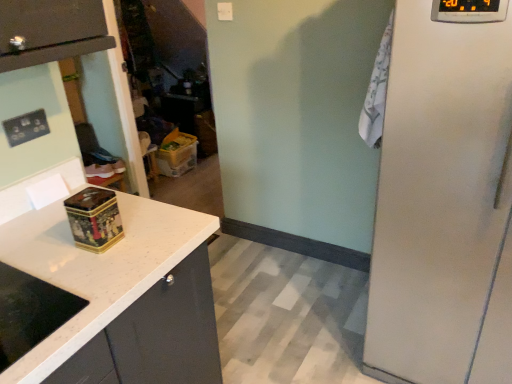
The width and height of the screenshot is (512, 384). Describe the element at coordinates (174, 90) in the screenshot. I see `transparent plastic door at center` at that location.

The height and width of the screenshot is (384, 512). What are the coordinates of `white granite countertop at left` in the screenshot? It's located at (156, 335).

This screenshot has height=384, width=512. Describe the element at coordinates (94, 219) in the screenshot. I see `gold metallic tin at center, the second appliance when ordered from front to back` at that location.

Identify the location of matte black outlet at upper left. The image size is (512, 384). (26, 127).

Which of these two, matte black outlet at upper left or transparent plastic door at center, is thinner?

With smaller width is matte black outlet at upper left.

Between matte black outlet at upper left and transparent plastic door at center, which one has smaller size?

Smaller between the two is matte black outlet at upper left.

Would you consider matte black outlet at upper left to be distant from transparent plastic door at center?

That's right, there is a large distance between matte black outlet at upper left and transparent plastic door at center.

In the scene shown: Considering the relative positions of matte black outlet at upper left and transparent plastic door at center in the image provided, is matte black outlet at upper left to the right of transparent plastic door at center from the viewer's perspective?

In fact, matte black outlet at upper left is to the left of transparent plastic door at center.

How many degrees apart are the facing directions of transparent plastic door at center and matte black outlet at upper left?

They differ by 88.8 degrees in their facing directions.

Is there a large distance between transparent plastic door at center and matte black outlet at upper left?

Yes, transparent plastic door at center and matte black outlet at upper left are located far from each other.

From a real-world perspective, is transparent plastic door at center beneath matte black outlet at upper left?

Yes, from a real-world perspective, transparent plastic door at center is below matte black outlet at upper left.

From the picture: Which is behind, transparent plastic door at center or matte black outlet at upper left?

transparent plastic door at center is more distant.

Does satin white refrigerator at right, the 1th appliance viewed from the top, turn towards transparent plastic door at center?

No, satin white refrigerator at right, the 1th appliance viewed from the top, is not turned towards transparent plastic door at center.

Which of these two, satin white refrigerator at right, marked as the second appliance in a bottom-to-top arrangement, or transparent plastic door at center, is smaller?

With smaller size is transparent plastic door at center.

From a real-world perspective, is satin white refrigerator at right, the first appliance from the front, below transparent plastic door at center?

Yes.

Is satin white refrigerator at right, the 1th appliance viewed from the top, positioned beyond the bounds of transparent plastic door at center?

Yes, satin white refrigerator at right, the 1th appliance viewed from the top, is not within transparent plastic door at center.

Which is in front, point (430, 364) or point (15, 130)?

The point (15, 130) is closer to the camera.

Where is `electric outlet above the satin white refrigerator at right, which appears as the second appliance when viewed from the back (from a real-world perspective)`? The image size is (512, 384). electric outlet above the satin white refrigerator at right, which appears as the second appliance when viewed from the back (from a real-world perspective) is located at coordinates (26, 127).

From a real-world perspective, does satin white refrigerator at right, the first appliance from the front, sit lower than matte black outlet at upper left?

Yes.

Can you tell me how much satin white refrigerator at right, the 1th appliance viewed from the top, and matte black outlet at upper left differ in facing direction?

90.3 degrees.

Between transparent plastic door at center and gold metallic tin at center, the 2th appliance viewed from the right, which one is positioned behind?

transparent plastic door at center is further from the camera.

Could you measure the distance between transparent plastic door at center and gold metallic tin at center, the 2th appliance viewed from the right?

They are 2.39 meters apart.

Is transparent plastic door at center facing away from gold metallic tin at center, which ranks as the first appliance in left-to-right order?

No, transparent plastic door at center is not facing away from gold metallic tin at center, which ranks as the first appliance in left-to-right order.

Is transparent plastic door at center positioned beyond the bounds of gold metallic tin at center, acting as the 1th appliance starting from the bottom?

Yes, transparent plastic door at center is not within gold metallic tin at center, acting as the 1th appliance starting from the bottom.

Which point is more forward, (92, 230) or (188, 110)?

The point (92, 230) is in front.

Between gold metallic tin at center, which ranks as the first appliance in left-to-right order, and transparent plastic door at center, which one has smaller size?

gold metallic tin at center, which ranks as the first appliance in left-to-right order, is smaller.

From a real-world perspective, which is physically below, gold metallic tin at center, which ranks as the first appliance in left-to-right order, or transparent plastic door at center?

transparent plastic door at center, from a real-world perspective.

From the image's perspective, which one is positioned higher, gold metallic tin at center, acting as the 1th appliance starting from the bottom, or transparent plastic door at center?

transparent plastic door at center, from the image's perspective.

Which is nearer, (x=73, y=207) or (x=438, y=337)?

Point (x=73, y=207) is positioned closer to the camera compared to point (x=438, y=337).

Considering the sizes of objects gold metallic tin at center, which ranks as the first appliance in left-to-right order, and satin white refrigerator at right, the 1th appliance viewed from the top, in the image provided, who is smaller, gold metallic tin at center, which ranks as the first appliance in left-to-right order, or satin white refrigerator at right, the 1th appliance viewed from the top,?

gold metallic tin at center, which ranks as the first appliance in left-to-right order.

Considering the positions of objects gold metallic tin at center, acting as the 1th appliance starting from the bottom, and satin white refrigerator at right, the first appliance from the front, in the image provided, who is in front, gold metallic tin at center, acting as the 1th appliance starting from the bottom, or satin white refrigerator at right, the first appliance from the front,?

satin white refrigerator at right, the first appliance from the front, is closer to the camera.

From the image's perspective, is gold metallic tin at center, the second appliance when ordered from front to back, positioned above or below satin white refrigerator at right, marked as the second appliance in a bottom-to-top arrangement?

gold metallic tin at center, the second appliance when ordered from front to back, is below satin white refrigerator at right, marked as the second appliance in a bottom-to-top arrangement.

Find the location of a particular element. This screenshot has width=512, height=384. glass door behind the matte black outlet at upper left is located at coordinates (174, 90).

Where is `electric outlet located in front of the transparent plastic door at center`? Image resolution: width=512 pixels, height=384 pixels. electric outlet located in front of the transparent plastic door at center is located at coordinates (26, 127).

From the image, which object appears to be farther from transparent plastic door at center, satin white refrigerator at right, marked as the second appliance in a bottom-to-top arrangement, or matte black outlet at upper left?

matte black outlet at upper left is positioned further to the anchor transparent plastic door at center.

Estimate the real-world distances between objects in this image. Which object is closer to gold metallic tin at center, the second appliance from the top, matte black outlet at upper left or satin white refrigerator at right, marked as the second appliance in a bottom-to-top arrangement?

The object closer to gold metallic tin at center, the second appliance from the top, is matte black outlet at upper left.

Looking at the image, which one is located closer to white granite countertop at left, gold metallic tin at center, which ranks as the first appliance in left-to-right order, or satin white refrigerator at right, which appears as the 2th appliance when viewed from the left?

gold metallic tin at center, which ranks as the first appliance in left-to-right order, is closer to white granite countertop at left.

Estimate the real-world distances between objects in this image. Which object is further from matte black outlet at upper left, white granite countertop at left or transparent plastic door at center?

Based on the image, transparent plastic door at center appears to be further to matte black outlet at upper left.

Based on their spatial positions, is satin white refrigerator at right, the first appliance from the front, or gold metallic tin at center, the second appliance when ordered from front to back, closer to transparent plastic door at center?

Based on the image, satin white refrigerator at right, the first appliance from the front, appears to be nearer to transparent plastic door at center.

Which object lies nearer to the anchor point gold metallic tin at center, the second appliance when ordered from front to back, satin white refrigerator at right, the first appliance from the front, or matte black outlet at upper left?

matte black outlet at upper left lies closer to gold metallic tin at center, the second appliance when ordered from front to back, than the other object.

Which object lies further to the anchor point satin white refrigerator at right, the 1th appliance viewed from the top, matte black outlet at upper left or white granite countertop at left?

The object further to satin white refrigerator at right, the 1th appliance viewed from the top, is matte black outlet at upper left.

When comparing their distances from gold metallic tin at center, which ranks as the first appliance in left-to-right order, does matte black outlet at upper left or transparent plastic door at center seem closer?

matte black outlet at upper left is positioned closer to the anchor gold metallic tin at center, which ranks as the first appliance in left-to-right order.

Find the location of a particular element. The image size is (512, 384). appliance located between matte black outlet at upper left and satin white refrigerator at right, marked as the second appliance in a bottom-to-top arrangement, in the left-right direction is located at coordinates (94, 219).

Locate an element on the screen. Image resolution: width=512 pixels, height=384 pixels. electric outlet positioned between gold metallic tin at center, the second appliance when ordered from front to back, and transparent plastic door at center from near to far is located at coordinates (26, 127).

Where is `electric outlet between white granite countertop at left and transparent plastic door at center along the z-axis`? The height and width of the screenshot is (384, 512). electric outlet between white granite countertop at left and transparent plastic door at center along the z-axis is located at coordinates (26, 127).

Find the location of a particular element. This screenshot has width=512, height=384. appliance situated between white granite countertop at left and satin white refrigerator at right, which appears as the second appliance when viewed from the back, from left to right is located at coordinates (94, 219).